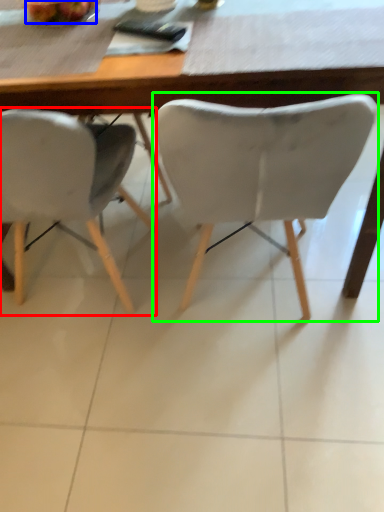
Question: Estimate the real-world distances between objects in this image. Which object is farther from chair (highlighted by a red box), fruit (highlighted by a blue box) or chair (highlighted by a green box)?

Choices:
 (A) fruit
 (B) chair

Answer: (A)